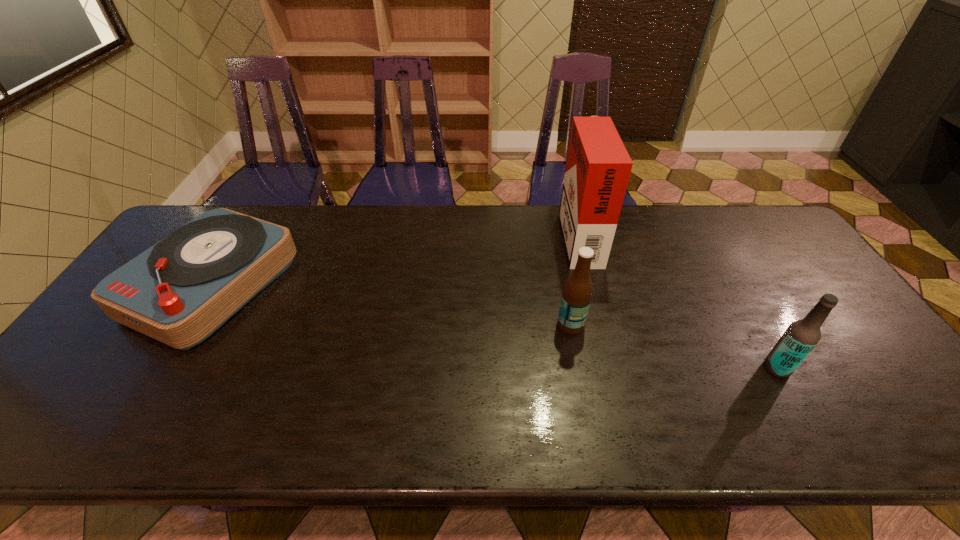
The width and height of the screenshot is (960, 540). I want to click on cigarette case, so click(x=598, y=166).

The image size is (960, 540). Identify the location of the left beer bottle. (577, 293).

This screenshot has height=540, width=960. What are the coordinates of `the nearest object` in the screenshot? It's located at (801, 336).

Where is `the right beer bottle`? the right beer bottle is located at coordinates (801, 336).

You are a GUI agent. You are given a task and a screenshot of the screen. Output one action in this format:
    pyautogui.click(x=<x>, y=<y>)
    Task: Click on the shortest object
    This screenshot has height=540, width=960.
    Given the screenshot: What is the action you would take?
    pyautogui.click(x=181, y=290)

Locate an element on the screen. the leftmost object is located at coordinates (181, 290).

The image size is (960, 540). I want to click on free space located on the front-facing side of the cigarette case, so click(473, 234).

You are a GUI agent. You are given a task and a screenshot of the screen. Output one action in this format:
    pyautogui.click(x=<x>, y=<y>)
    Task: Click on the blank space located 0.220m on the front-facing side of the cigarette case
    The height and width of the screenshot is (540, 960).
    Given the screenshot: What is the action you would take?
    pyautogui.click(x=495, y=234)

Where is `vacant space located 0.220m on the front-facing side of the cigarette case`? vacant space located 0.220m on the front-facing side of the cigarette case is located at coordinates (495, 234).

At what (x,y) coordinates should I click in order to perform the action: click on free space located on the right of the left beer bottle. Please return your answer as a coordinate pair (x, y). Looking at the image, I should click on (683, 325).